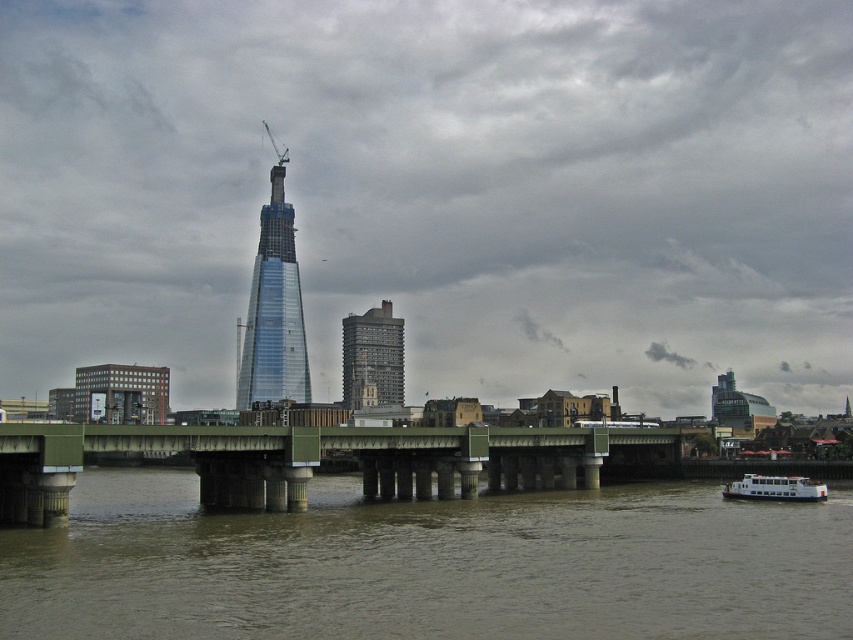
Who is more distant from viewer, (128,481) or (396,381)?

The point (396,381) is behind.

Can you confirm if brown muddy water at lower center is positioned to the left of dark gray concrete building at center?

No, brown muddy water at lower center is not to the left of dark gray concrete building at center.

Find the location of `brown muddy water at lower center`. brown muddy water at lower center is located at coordinates (428, 564).

Locate an element on the screen. The width and height of the screenshot is (853, 640). brown muddy water at lower center is located at coordinates (428, 564).

Which is more to the left, transparent glass tower at center or dark gray concrete building at center?

transparent glass tower at center

Does transparent glass tower at center have a smaller size compared to dark gray concrete building at center?

No, transparent glass tower at center is not smaller than dark gray concrete building at center.

The width and height of the screenshot is (853, 640). Describe the element at coordinates (274, 307) in the screenshot. I see `transparent glass tower at center` at that location.

Find the location of `transparent glass tower at center`. transparent glass tower at center is located at coordinates (274, 307).

Is point (345, 365) behind point (757, 474)?

Yes, it is behind point (757, 474).

Describe the element at coordinates (372, 358) in the screenshot. I see `dark gray concrete building at center` at that location.

What do you see at coordinates (372, 358) in the screenshot?
I see `dark gray concrete building at center` at bounding box center [372, 358].

Find the location of a particular element. This screenshot has height=640, width=853. dark gray concrete building at center is located at coordinates (372, 358).